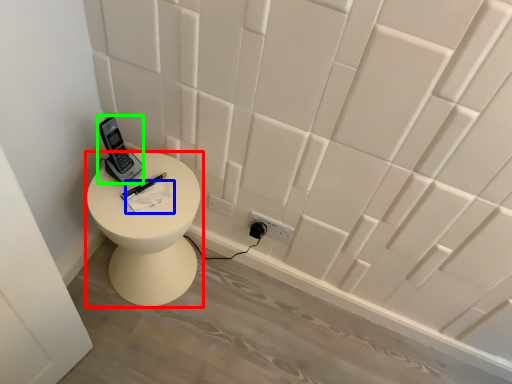
Question: Which object is the closest to the furniture (highlighted by a red box)? Choose among these: notepad (highlighted by a blue box) or control (highlighted by a green box).

Choices:
 (A) notepad
 (B) control

Answer: (A)